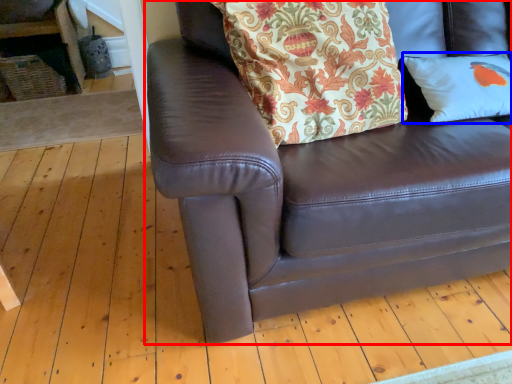
Question: Among these objects, which one is farthest to the camera, studio couch (highlighted by a red box) or pillow (highlighted by a blue box)?

Choices:
 (A) studio couch
 (B) pillow

Answer: (B)